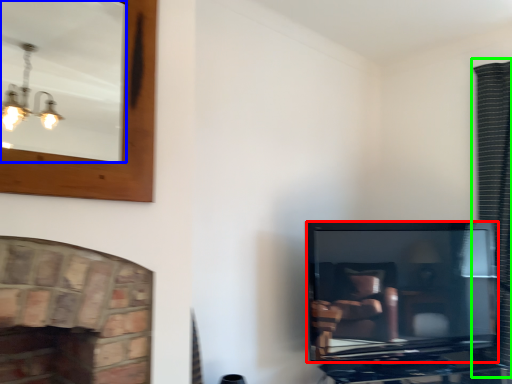
Question: Which object is positioned closest to television (highlighted by a red box)? Select from mirror (highlighted by a blue box) and curtain (highlighted by a green box).

Choices:
 (A) mirror
 (B) curtain

Answer: (B)